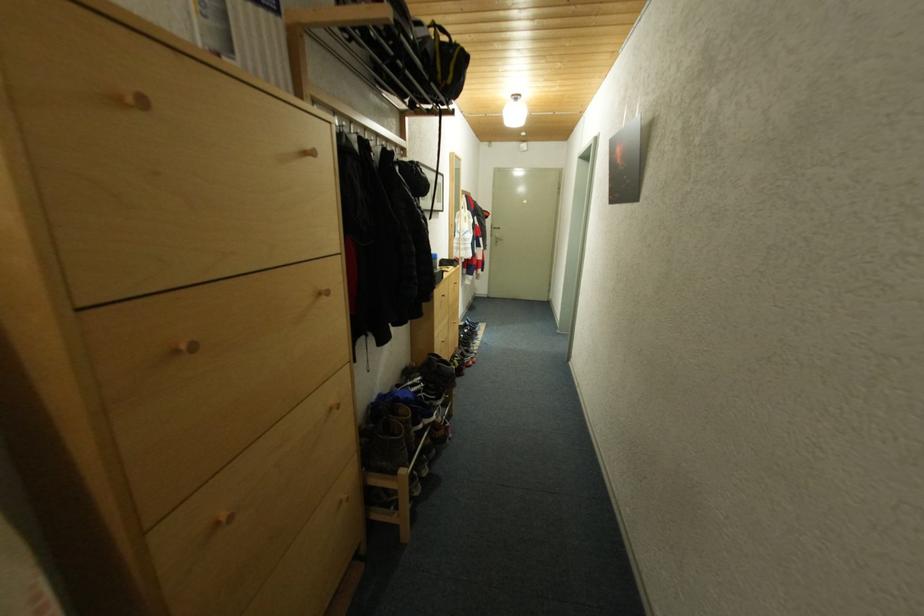
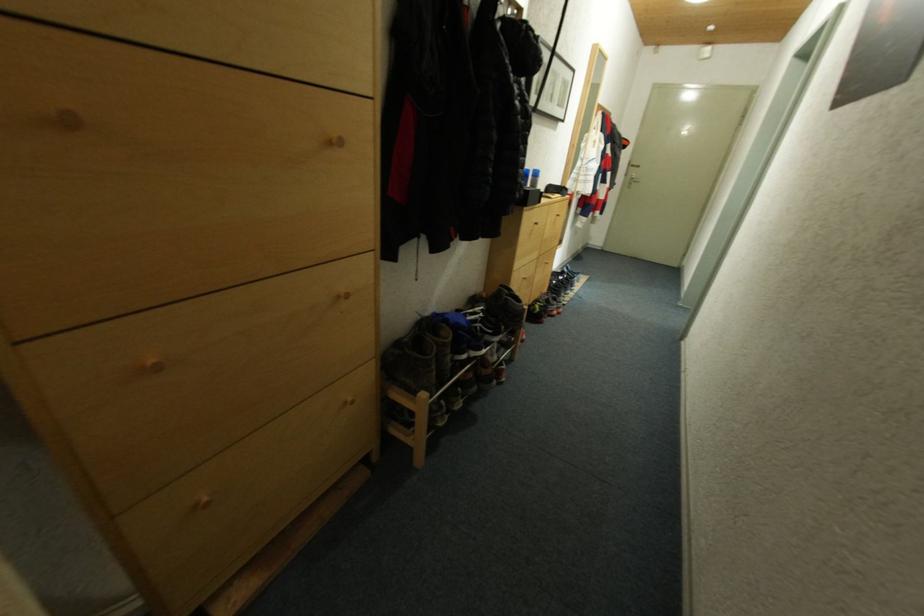
Question: The camera is either moving clockwise (left) or counter-clockwise (right) around the object. The first image is from the beginning of the video and the second image is from the end. Is the camera moving left or right when shooting the video?

Choices:
 (A) Left
 (B) Right

Answer: (B)